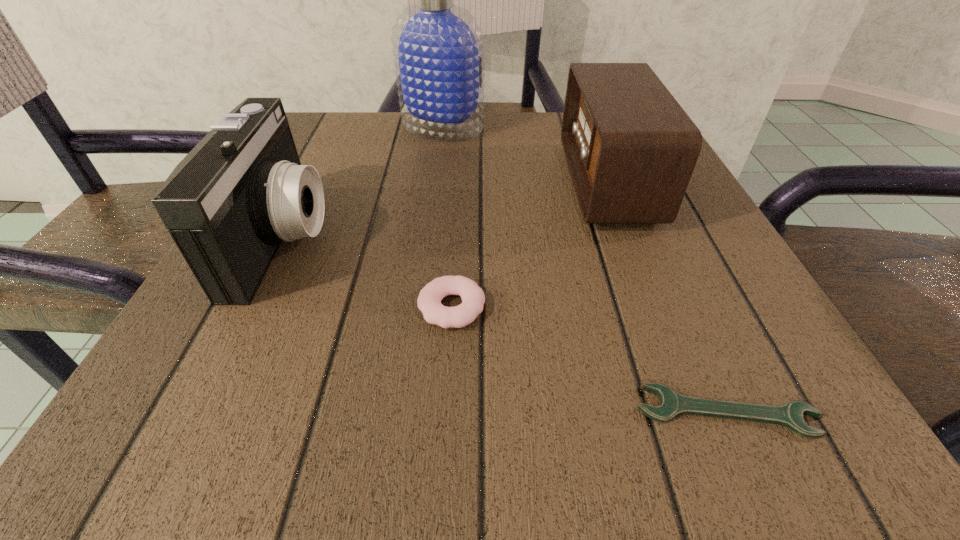
This screenshot has width=960, height=540. Find the location of `the farthest object`. the farthest object is located at coordinates (438, 46).

Where is `cleansing agent`? The width and height of the screenshot is (960, 540). cleansing agent is located at coordinates (438, 46).

You are a GUI agent. You are given a task and a screenshot of the screen. Output one action in this format:
    pyautogui.click(x=<x>, y=<y>)
    Task: Click on the camcorder
    
    Given the screenshot: What is the action you would take?
    pyautogui.click(x=228, y=205)

At what (x,y) coordinates should I click in order to perform the action: click on radio receiver. Please return your answer as a coordinate pair (x, y). The height and width of the screenshot is (540, 960). Looking at the image, I should click on (631, 149).

What are the coordinates of `doughnut` in the screenshot? It's located at (429, 300).

Where is `wrench`? The height and width of the screenshot is (540, 960). wrench is located at coordinates (672, 404).

Where is `the shortest object`? The height and width of the screenshot is (540, 960). the shortest object is located at coordinates (672, 404).

I want to click on free region located on the left of the tallest object, so click(331, 127).

Identify the location of free spot located 0.090m on the lens of the camcorder. The width and height of the screenshot is (960, 540). (383, 238).

Locate an element on the screen. The image size is (960, 540). free region located 0.150m on the front-facing side of the radio receiver is located at coordinates (486, 183).